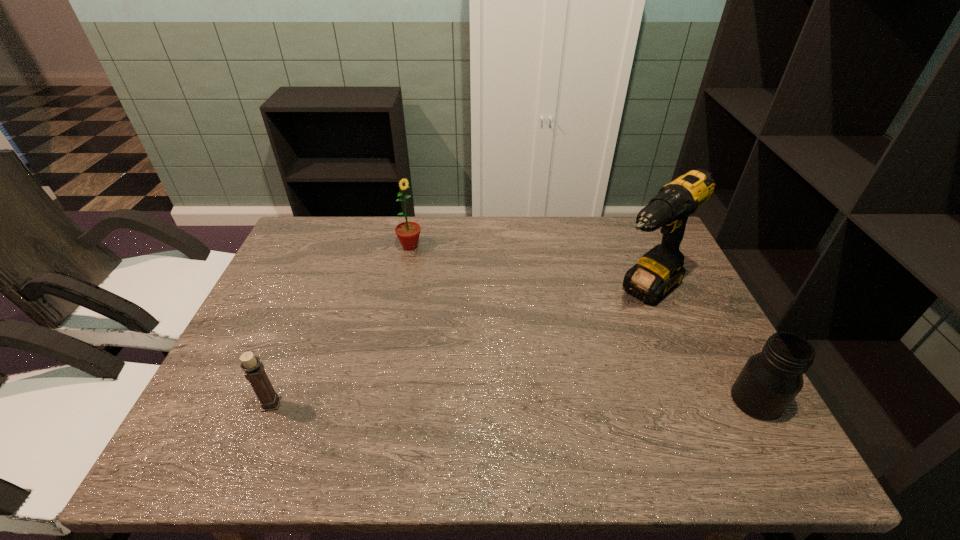
Identify the location of vacant space that satisfies the following two spatial constraints: 1. on the back side of the third shortest object; 2. on the right side of the candle holder. (336, 246).

In order to click on vacant space that satisfies the following two spatial constraints: 1. on the front side of the third nearest object; 2. on the left side of the jar in this screenshot , I will do `click(690, 401)`.

Identify the location of blank space that satisfies the following two spatial constraints: 1. on the back side of the leftmost object; 2. on the left side of the jar. (273, 401).